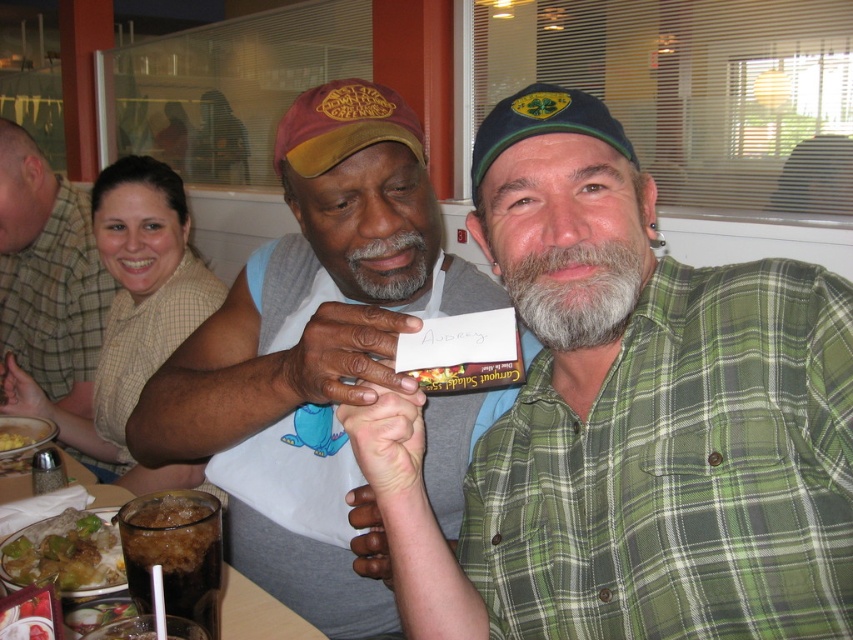
Question: Does green plaid shirt at upper right have a smaller size compared to graysoftbeard at right?

Choices:
 (A) yes
 (B) no

Answer: (B)

Question: Estimate the real-world distances between objects in this image. Which object is closer to the yellowish matte pasta at lower left?

Choices:
 (A) green plaid shirt at center
 (B) brown glossy rice bowl at lower left

Answer: (B)

Question: Which point appears closest to the camera in this image?

Choices:
 (A) (239, 621)
 (B) (624, 529)

Answer: (B)

Question: Does green plaid shirt at upper right have a larger size compared to glossy paper bag at center?

Choices:
 (A) yes
 (B) no

Answer: (A)

Question: Based on their relative distances, which object is nearer to the green plaid shirt at upper right?

Choices:
 (A) graysoftbeard at right
 (B) graysoftbeard at center
 (C) green plaid shirt at center
 (D) glossy paper bag at center

Answer: (B)

Question: Can you confirm if graysoftbeard at right is smaller than graysoftbeard at center?

Choices:
 (A) no
 (B) yes

Answer: (A)